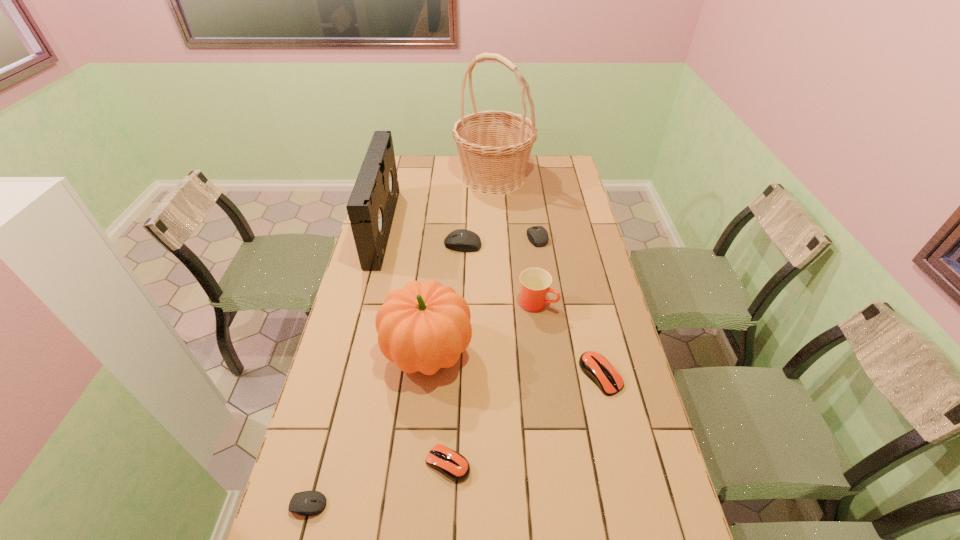
This screenshot has width=960, height=540. Find the location of `object that is at the right edge`. object that is at the right edge is located at coordinates (595, 366).

In the image, there is a desktop. Where is `free region at the far edge`? The image size is (960, 540). free region at the far edge is located at coordinates (452, 177).

This screenshot has width=960, height=540. I want to click on free space at the left edge of the desktop, so click(347, 373).

Find the location of a particular element. The height and width of the screenshot is (540, 960). vacant space at the right edge of the desktop is located at coordinates (618, 348).

Find the location of a particular element. Image resolution: width=960 pixels, height=540 pixels. vacant area at the far right corner of the desktop is located at coordinates (541, 168).

Where is `free space that is in between the videotape and the basket`? Image resolution: width=960 pixels, height=540 pixels. free space that is in between the videotape and the basket is located at coordinates (439, 202).

The image size is (960, 540). What are the coordinates of `free spot between the gray videotape and the biggest black computer equipment` in the screenshot? It's located at (422, 236).

Locate an element on the screen. Image resolution: width=960 pixels, height=540 pixels. free spot between the leftmost computer equipment and the orange pumpkin is located at coordinates (368, 428).

I want to click on free point between the third tallest object and the basket, so click(x=461, y=265).

In order to click on blank region between the videotape and the nearest object in this screenshot , I will do `click(346, 366)`.